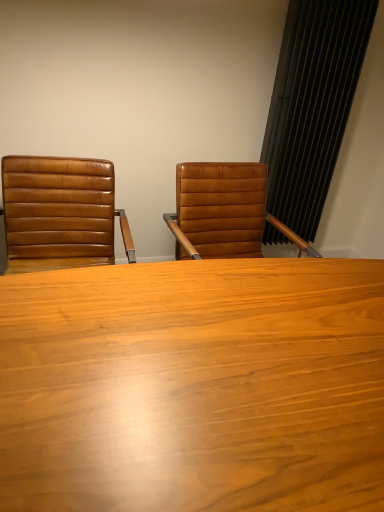
This screenshot has width=384, height=512. Find the location of `wooden table at center`. wooden table at center is located at coordinates (194, 386).

Image resolution: width=384 pixels, height=512 pixels. What are the coordinates of `wooden table at center` in the screenshot? It's located at (194, 386).

Is point (67, 179) behind point (349, 6)?

No.

From a real-world perspective, which is physically above, brown leather chair at left or black textured curtain at right?

In real-world perspective, black textured curtain at right is above.

In order to click on chair in front of the black textured curtain at right in this screenshot , I will do `click(60, 213)`.

Between point (287, 169) and point (312, 498), which one is positioned behind?

The point (287, 169) is farther.

From a real-world perspective, is black textured curtain at right on wooden table at center?

Correct, in the physical world, black textured curtain at right is higher than wooden table at center.

Locate an element on the screen. The height and width of the screenshot is (512, 384). table located below the black textured curtain at right (from the image's perspective) is located at coordinates (194, 386).

Is black textured curtain at right facing towards wooden table at center?

No, black textured curtain at right is not turned towards wooden table at center.

Which point is more distant from viewer, [163,381] or [289,69]?

Point [289,69]

Can you confirm if wooden table at center is bigger than black textured curtain at right?

Yes, wooden table at center is bigger than black textured curtain at right.

From the image's perspective, is wooden table at center above or below black textured curtain at right?

wooden table at center is situated lower than black textured curtain at right in the image.

From a real-world perspective, who is located higher, wooden table at center or black textured curtain at right?

From a 3D spatial view, black textured curtain at right is above.

Does wooden table at center come behind brown leather chair at left?

No, wooden table at center is closer to the camera.

From a real-world perspective, which object stands above the other?

In real-world perspective, brown leather chair at left is above.

The image size is (384, 512). What are the coordinates of `chair that appears above the wooden table at center (from a real-world perspective)` in the screenshot? It's located at pos(60,213).

Would you say wooden table at center is outside brown leather chair at left?

wooden table at center is positioned outside brown leather chair at left.

This screenshot has width=384, height=512. I want to click on chair that appears below the black textured curtain at right (from a real-world perspective), so click(60, 213).

Is black textured curtain at right looking in the opposite direction of brown leather chair at left?

That's not correct — black textured curtain at right is not looking away from brown leather chair at left.

Considering the relative sizes of black textured curtain at right and brown leather chair at left in the image provided, is black textured curtain at right wider than brown leather chair at left?

No.

Considering the sizes of objects brown leather chair at left and wooden table at center in the image provided, who is bigger, brown leather chair at left or wooden table at center?

Bigger between the two is wooden table at center.

Is brown leather chair at left looking in the opposite direction of wooden table at center?

brown leather chair at left does not have its back to wooden table at center.

The width and height of the screenshot is (384, 512). I want to click on curtain above the brown leather chair at left (from a real-world perspective), so (x=312, y=105).

Identify the location of table on the left of the black textured curtain at right. (194, 386).

From the image, which object appears to be farther from brown leather chair at left, black textured curtain at right or wooden table at center?

The object further to brown leather chair at left is black textured curtain at right.

Looking at the image, which one is located further to wooden table at center, black textured curtain at right or brown leather chair at left?

black textured curtain at right is positioned further to the anchor wooden table at center.

Considering their positions, is wooden table at center positioned closer to brown leather chair at left than black textured curtain at right?

wooden table at center is positioned closer to the anchor brown leather chair at left.

Based on their spatial positions, is brown leather chair at left or black textured curtain at right closer to wooden table at center?

The object closer to wooden table at center is brown leather chair at left.

Based on their spatial positions, is wooden table at center or brown leather chair at left closer to black textured curtain at right?

brown leather chair at left is positioned closer to the anchor black textured curtain at right.

From the image, which object appears to be nearer to black textured curtain at right, brown leather chair at left or wooden table at center?

Among the two, brown leather chair at left is located nearer to black textured curtain at right.

Find the location of a particular element. chair between wooden table at center and black textured curtain at right along the z-axis is located at coordinates (60, 213).